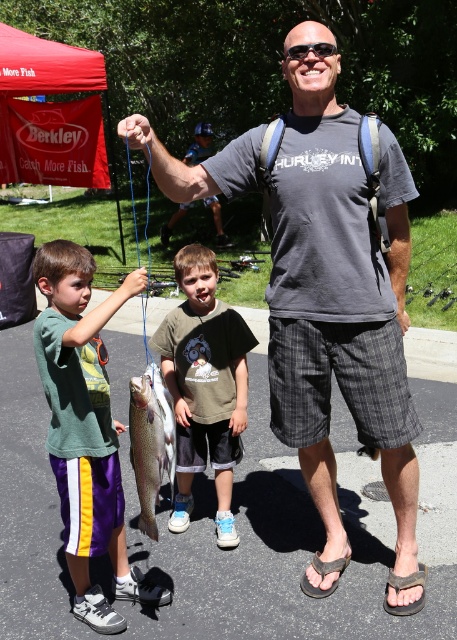
Between gray cotton t-shirt at center and shiny silver fish at center, which one appears on the right side from the viewer's perspective?

From the viewer's perspective, gray cotton t-shirt at center appears more on the right side.

Does gray cotton t-shirt at center have a larger size compared to shiny silver fish at center?

Correct, gray cotton t-shirt at center is larger in size than shiny silver fish at center.

Locate an element on the screen. gray cotton t-shirt at center is located at coordinates (340, 308).

From the picture: Can you confirm if green cotton shirt at center is positioned to the left of shiny silver fish at center?

Incorrect, green cotton shirt at center is not on the left side of shiny silver fish at center.

What do you see at coordinates (205, 385) in the screenshot? I see `green cotton shirt at center` at bounding box center [205, 385].

The height and width of the screenshot is (640, 457). Find the location of `green cotton shirt at center`. green cotton shirt at center is located at coordinates (205, 385).

Which of these two, gray cotton t-shirt at center or green fabric shirt at left, stands shorter?

Standing shorter between the two is green fabric shirt at left.

Is gray cotton t-shirt at center wider than green fabric shirt at left?

Yes.

Is point (306, 416) farther from camera compared to point (85, 284)?

Yes, point (306, 416) is behind point (85, 284).

Find the location of a particular element. This screenshot has width=457, height=640. gray cotton t-shirt at center is located at coordinates (340, 308).